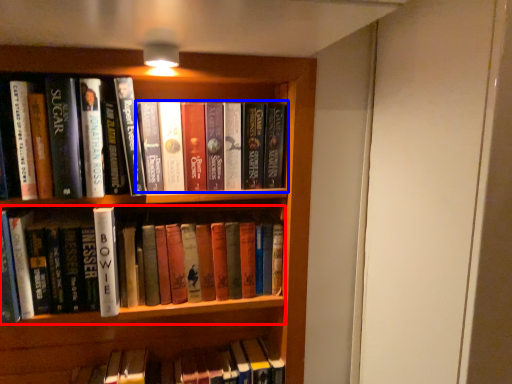
Question: Which object appears closest to the camera in this image, book (highlighted by a red box) or book (highlighted by a blue box)?

Choices:
 (A) book
 (B) book

Answer: (A)